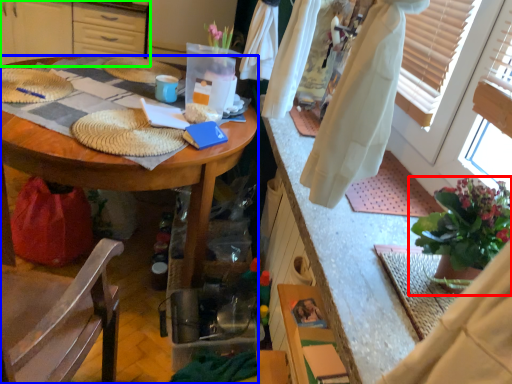
Question: Which object is the closest to the houseplant (highlighted by a red box)? Choose among these: desk (highlighted by a blue box) or cabinetry (highlighted by a green box).

Choices:
 (A) desk
 (B) cabinetry

Answer: (A)